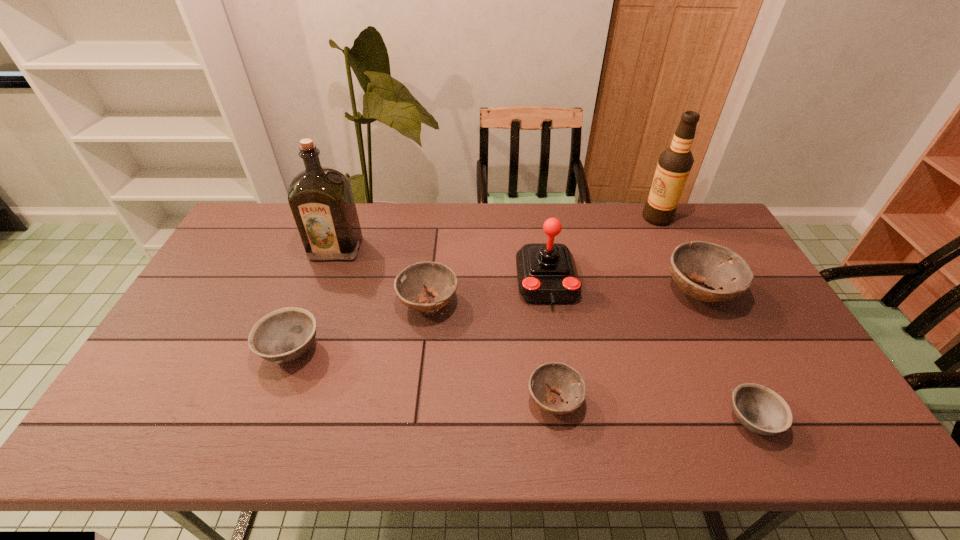
Where is `vacant area situated 0.300m on the front of the third object from left to right`? vacant area situated 0.300m on the front of the third object from left to right is located at coordinates (414, 426).

The image size is (960, 540). Find the location of `free space located 0.380m on the back of the left gray bowl`. free space located 0.380m on the back of the left gray bowl is located at coordinates (333, 240).

At what (x,y) coordinates should I click in order to perform the action: click on vacant space located 0.050m on the front of the smallest brown bowl. Please return your answer as a coordinate pair (x, y). The height and width of the screenshot is (540, 960). Looking at the image, I should click on (561, 447).

Find the location of `vacant position located 0.140m on the right of the right gray bowl`. vacant position located 0.140m on the right of the right gray bowl is located at coordinates (837, 420).

This screenshot has width=960, height=540. I want to click on alcohol that is positioned at the far edge, so click(x=674, y=165).

The height and width of the screenshot is (540, 960). Find the location of `liquor that is at the far edge`. liquor that is at the far edge is located at coordinates (321, 199).

The height and width of the screenshot is (540, 960). I want to click on alcohol present at the right edge, so click(674, 165).

The height and width of the screenshot is (540, 960). Find the location of `object that is at the far right corner`. object that is at the far right corner is located at coordinates (674, 165).

Locate an element on the screen. The width and height of the screenshot is (960, 540). object present at the near right corner is located at coordinates (761, 410).

I want to click on vacant area at the far edge, so click(591, 205).